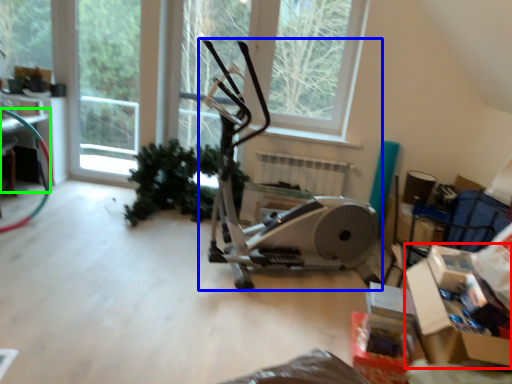
Question: Which object is positioned farthest from cardboard box (highlighted by a red box)? Select from stationary bicycle (highlighted by a blue box) and table (highlighted by a green box).

Choices:
 (A) stationary bicycle
 (B) table

Answer: (B)